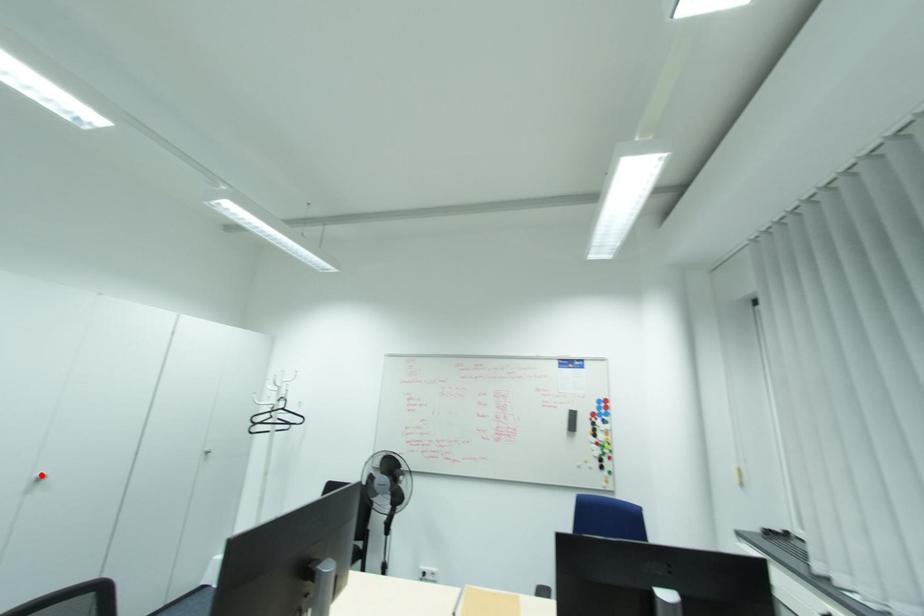
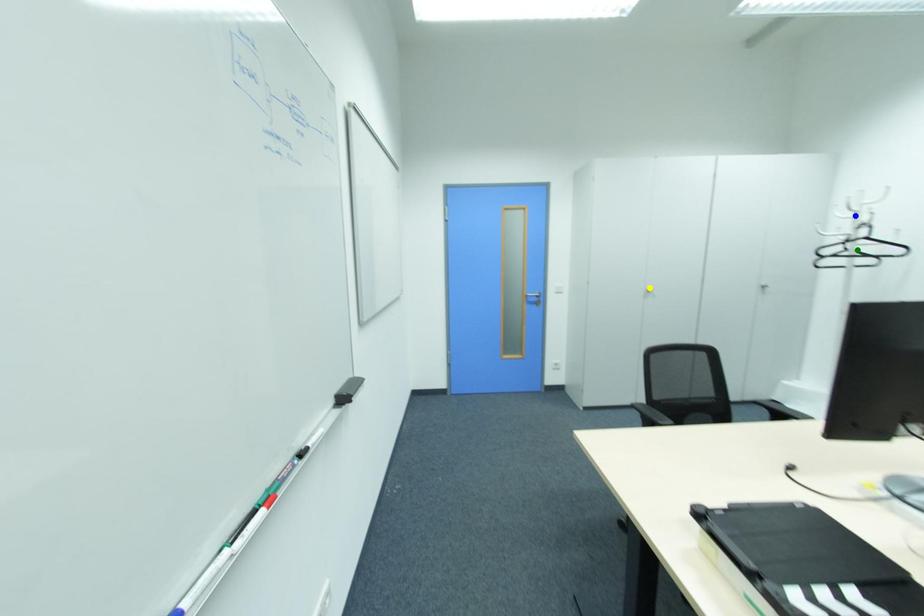
Question: I am providing you with two images of the same scene from different viewpoints. A red point is marked on the first image. You are given multiple points on the second image. Which point in image 2 represents the same 3d spot as the red point in image 1?

Choices:
 (A) yellow point
 (B) green point
 (C) blue point

Answer: (A)